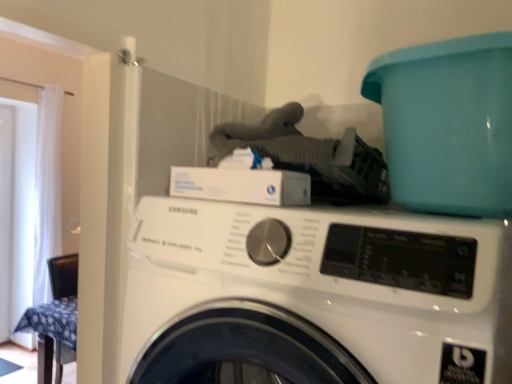
What do you see at coordinates (317, 293) in the screenshot? Image resolution: width=512 pixels, height=384 pixels. I see `white glossy washing machine at center` at bounding box center [317, 293].

Find the location of a particular element. white sheer curtain at left is located at coordinates (47, 189).

Is white glossy washing machine at center directly adjacent to white glossy screen door at left?

There is a gap between white glossy washing machine at center and white glossy screen door at left.

Where is `screen door below the white glossy washing machine at center (from the image's perspective)`? screen door below the white glossy washing machine at center (from the image's perspective) is located at coordinates (6, 217).

Considering the positions of objects white glossy washing machine at center and white glossy screen door at left in the image provided, who is behind, white glossy washing machine at center or white glossy screen door at left?

white glossy screen door at left.

From a real-world perspective, which object stands above the other?

From a 3D spatial view, white glossy washing machine at center is above.

In the scene shown: Is teal plastic bucket at upper right with white sheer curtain at left?

No, teal plastic bucket at upper right is not making contact with white sheer curtain at left.

Is teal plastic bucket at upper right behind white sheer curtain at left?

No, it is not.

What's the angular difference between teal plastic bucket at upper right and white sheer curtain at left's facing directions?

The angular difference between teal plastic bucket at upper right and white sheer curtain at left is 94 degrees.

Based on their positions, is teal plastic bucket at upper right located to the left or right of white sheer curtain at left?

Clearly, teal plastic bucket at upper right is on the right of white sheer curtain at left in the image.

Would you say white glossy screen door at left is outside white glossy washing machine at center?

Indeed, white glossy screen door at left is completely outside white glossy washing machine at center.

Considering the sizes of white glossy screen door at left and white glossy washing machine at center in the image, is white glossy screen door at left taller or shorter than white glossy washing machine at center?

In the image, white glossy screen door at left appears to be taller than white glossy washing machine at center.

From a real-world perspective, is white glossy screen door at left physically located above or below white glossy washing machine at center?

white glossy screen door at left is situated lower than white glossy washing machine at center in the real world.

Which of these two, white glossy screen door at left or white glossy washing machine at center, is wider?

white glossy washing machine at center.

Who is bigger, white sheer curtain at left or white glossy screen door at left?

white sheer curtain at left is bigger.

Is white sheer curtain at left oriented towards white glossy screen door at left?

No, white sheer curtain at left is not aimed at white glossy screen door at left.

Measure the distance between white sheer curtain at left and white glossy screen door at left.

white sheer curtain at left and white glossy screen door at left are 14.44 inches apart.

Is white sheer curtain at left placed right next to white glossy screen door at left?

They are not placed beside each other.

Which is less distant, (256, 291) or (38, 229)?

The point (256, 291) is in front.

In terms of height, does white glossy washing machine at center look taller or shorter compared to white sheer curtain at left?

In the image, white glossy washing machine at center appears to be shorter than white sheer curtain at left.

Is white glossy washing machine at center placed right next to white sheer curtain at left?

No, white glossy washing machine at center is not beside white sheer curtain at left.

From the image's perspective, is white sheer curtain at left located beneath teal plastic bucket at upper right?

Yes, from the image's perspective, white sheer curtain at left is beneath teal plastic bucket at upper right.

Is white sheer curtain at left turned away from teal plastic bucket at upper right?

That's not correct — white sheer curtain at left is not looking away from teal plastic bucket at upper right.

Does point (37, 133) come closer to viewer compared to point (419, 79)?

No, (37, 133) is further to viewer.

Which of these two, white sheer curtain at left or teal plastic bucket at upper right, is wider?

Wider between the two is teal plastic bucket at upper right.

What's the angular difference between white glossy screen door at left and teal plastic bucket at upper right's facing directions?

They differ by 91.4 degrees in their facing directions.

Between white glossy screen door at left and teal plastic bucket at upper right, which one has more height?

Standing taller between the two is white glossy screen door at left.

Would you say teal plastic bucket at upper right is part of white glossy screen door at left's contents?

No.

What are the coordinates of `washing machine located in front of the white glossy screen door at left` in the screenshot? It's located at (317, 293).

Identify the location of teal above the white sheer curtain at left (from a real-world perspective). (448, 124).

When comparing their distances from white glossy screen door at left, does white glossy washing machine at center or white sheer curtain at left seem further?

white glossy washing machine at center.

When comparing their distances from teal plastic bucket at upper right, does white sheer curtain at left or white glossy screen door at left seem closer?

Among the two, white sheer curtain at left is located nearer to teal plastic bucket at upper right.

Which object lies nearer to the anchor point white sheer curtain at left, white glossy screen door at left or white glossy washing machine at center?

white glossy screen door at left lies closer to white sheer curtain at left than the other object.

Estimate the real-world distances between objects in this image. Which object is closer to white sheer curtain at left, white glossy screen door at left or teal plastic bucket at upper right?

white glossy screen door at left lies closer to white sheer curtain at left than the other object.

Considering their positions, is teal plastic bucket at upper right positioned closer to white glossy screen door at left than white sheer curtain at left?

white sheer curtain at left.

Based on their spatial positions, is white glossy washing machine at center or teal plastic bucket at upper right closer to white sheer curtain at left?

white glossy washing machine at center lies closer to white sheer curtain at left than the other object.

Considering their positions, is white glossy screen door at left positioned further to white glossy washing machine at center than white sheer curtain at left?

white glossy screen door at left lies further to white glossy washing machine at center than the other object.

From the picture: Which object lies further to the anchor point teal plastic bucket at upper right, white glossy washing machine at center or white sheer curtain at left?

Among the two, white sheer curtain at left is located further to teal plastic bucket at upper right.

The image size is (512, 384). In order to click on curtain between white glossy washing machine at center and white glossy screen door at left in the front-back direction in this screenshot , I will do `click(47, 189)`.

The height and width of the screenshot is (384, 512). Find the location of `teal between white glossy washing machine at center and white glossy screen door at left in the front-back direction`. teal between white glossy washing machine at center and white glossy screen door at left in the front-back direction is located at coordinates (448, 124).

Locate an element on the screen. The height and width of the screenshot is (384, 512). teal positioned between white glossy washing machine at center and white sheer curtain at left from near to far is located at coordinates (448, 124).

You are a GUI agent. You are given a task and a screenshot of the screen. Output one action in this format:
    pyautogui.click(x=<x>, y=<y>)
    Task: Click on the curtain located between teal plastic bucket at upper right and white glossy screen door at left in the depth direction
    The image size is (512, 384).
    Given the screenshot: What is the action you would take?
    pyautogui.click(x=47, y=189)